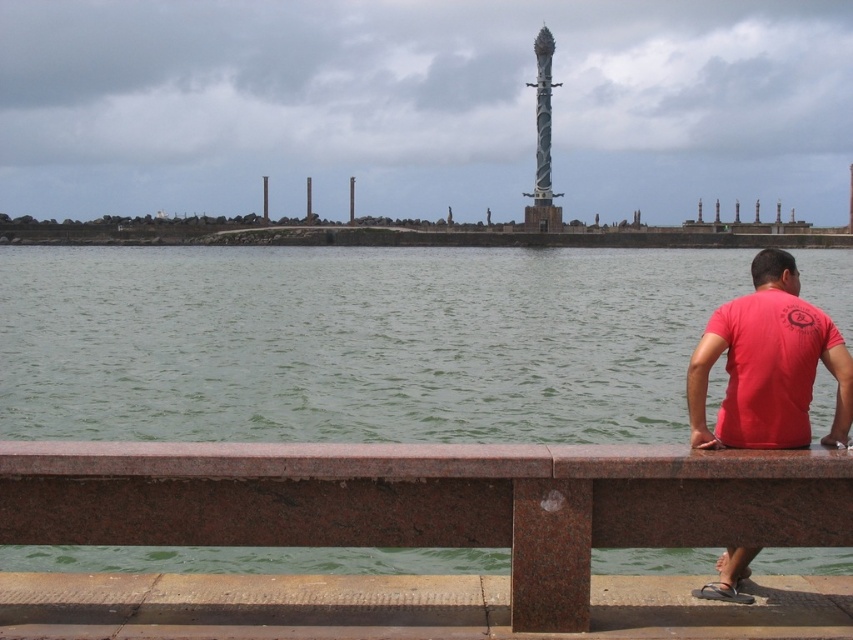
Can you confirm if brown polished stone dock at lower center is taller than red matte shirt at lower right?

No.

Between point (837, 620) and point (730, 323), which one is positioned behind?

The point (730, 323) is more distant.

The image size is (853, 640). Find the location of `brown polished stone dock at lower center`. brown polished stone dock at lower center is located at coordinates (396, 608).

Can you confirm if red matte shirt at lower right is positioned above spiral metal pole at center?

Incorrect, red matte shirt at lower right is not positioned above spiral metal pole at center.

Who is shorter, red matte shirt at lower right or spiral metal pole at center?

With less height is red matte shirt at lower right.

The width and height of the screenshot is (853, 640). Describe the element at coordinates (769, 365) in the screenshot. I see `red matte shirt at lower right` at that location.

The image size is (853, 640). Identify the location of red matte shirt at lower right. (769, 365).

Based on the photo, can you confirm if green water at lower center is positioned to the right of spiral metal pole at center?

Incorrect, green water at lower center is not on the right side of spiral metal pole at center.

Identify the location of green water at lower center. (352, 342).